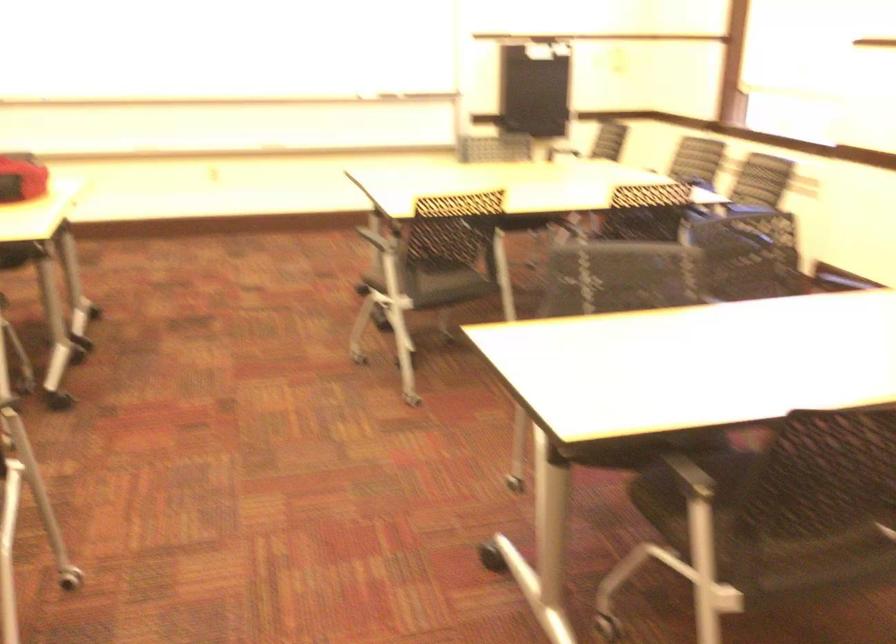
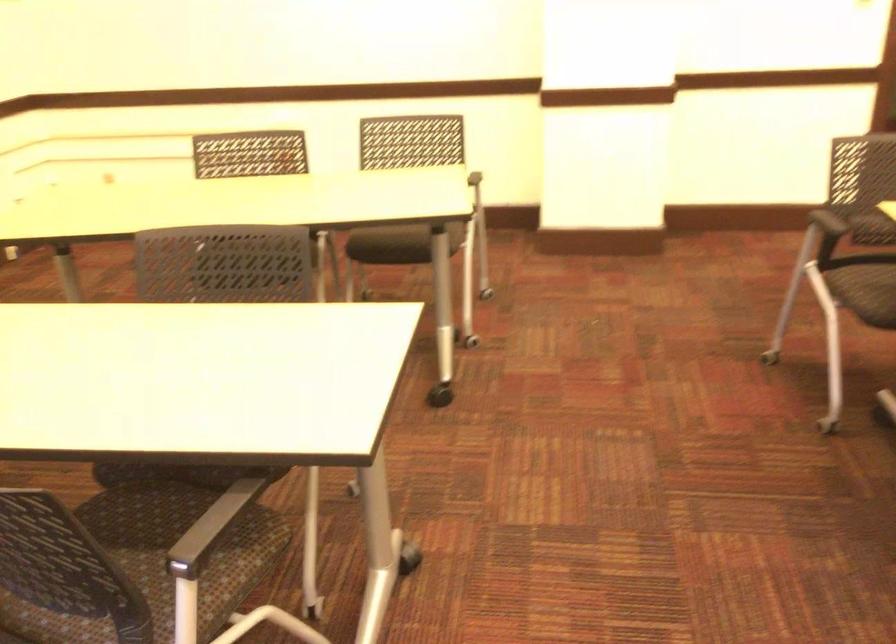
Where in the second image is the point corresponding to (546,339) from the first image?

(210, 527)